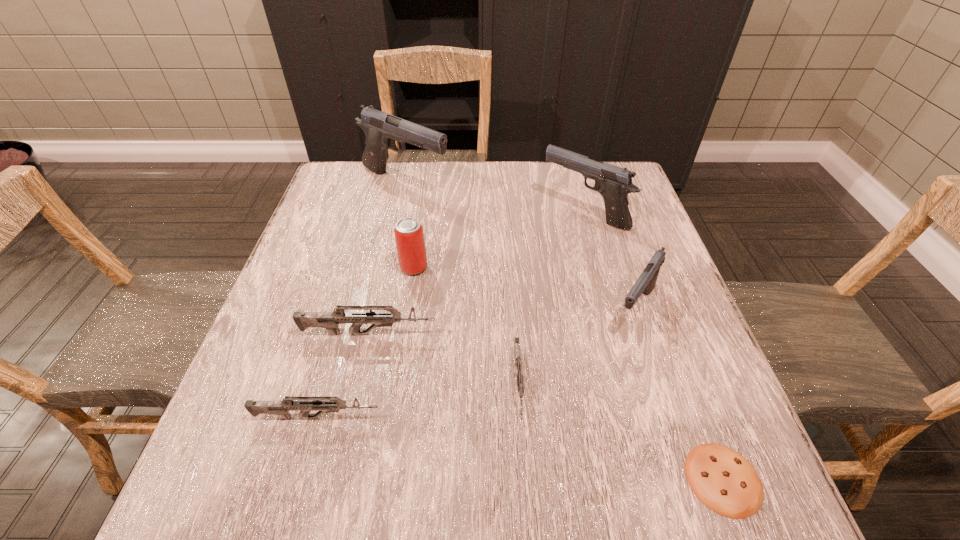
The image size is (960, 540). What are the coordinates of `object that is at the near right corner` in the screenshot? It's located at (726, 482).

Locate an element on the screen. This screenshot has width=960, height=540. free space at the far edge is located at coordinates (439, 173).

At what (x,y) coordinates should I click in order to perform the action: click on vacant position at the near edge of the desktop. Please return your answer as a coordinate pair (x, y). Looking at the image, I should click on (436, 492).

The image size is (960, 540). I want to click on vacant space at the left edge of the desktop, so click(x=328, y=343).

The image size is (960, 540). Find the location of `free space at the right edge of the desktop`. free space at the right edge of the desktop is located at coordinates (624, 230).

In the image, there is a desktop. What are the coordinates of `vacant area at the far left corner` in the screenshot? It's located at (338, 163).

Where is `free point at the near left corner`? free point at the near left corner is located at coordinates (280, 467).

Locate an element on the screen. This screenshot has height=540, width=960. free space at the far right corner of the desktop is located at coordinates (599, 207).

In the image, there is a desktop. Identify the location of vacant space at the near right corner. Image resolution: width=960 pixels, height=540 pixels. (688, 500).

This screenshot has width=960, height=540. Identify the location of free space that is in between the third shortest object and the fourth tallest gun. (343, 376).